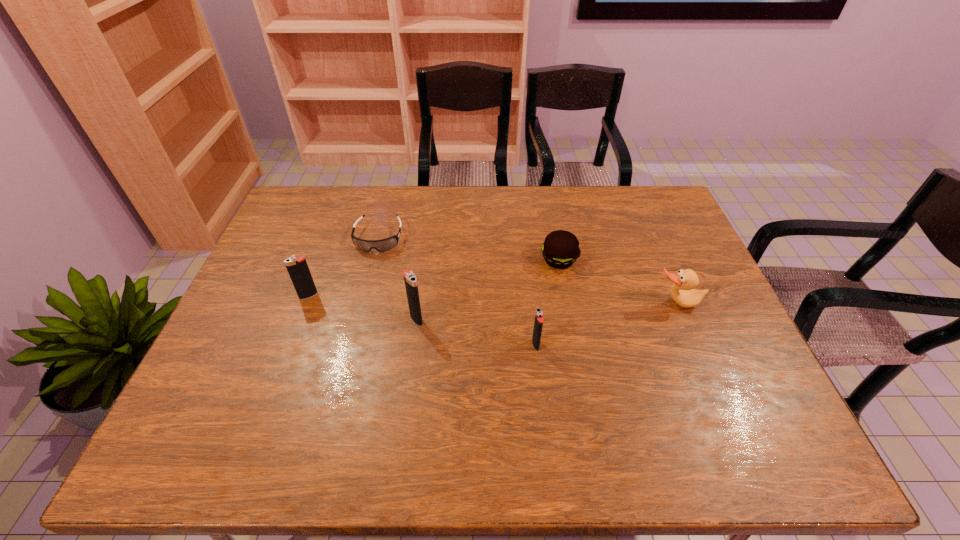
The height and width of the screenshot is (540, 960). In order to click on the second object from right to left in this screenshot , I will do `click(560, 249)`.

In order to click on vacant region located 0.120m on the front of the second tallest igniter in this screenshot , I will do `click(295, 334)`.

Locate an element on the screen. The image size is (960, 540). free region located 0.340m on the right of the second nearest igniter is located at coordinates point(549,319).

Find the location of `blank area located 0.210m on the right of the rightmost igniter`. blank area located 0.210m on the right of the rightmost igniter is located at coordinates (621, 345).

Locate an element on the screen. free space located on the front and sides of the fifth object from right to left is located at coordinates (350, 350).

I want to click on vacant space located 0.060m on the beak of the rightmost object, so click(x=687, y=329).

This screenshot has width=960, height=540. I want to click on free spot located on the left of the patty, so click(449, 260).

You are a GUI agent. You are given a task and a screenshot of the screen. Output one action in this format:
    pyautogui.click(x=<x>, y=<y>)
    Task: Click on the object present at the far edge
    This screenshot has height=540, width=960.
    Given the screenshot: What is the action you would take?
    pyautogui.click(x=383, y=245)

Identify the location of object at the left edge. This screenshot has width=960, height=540. [x=298, y=269].

Locate an element on the screen. object that is positioned at the right edge is located at coordinates (683, 293).